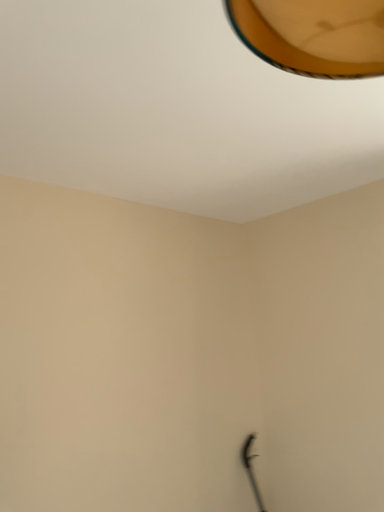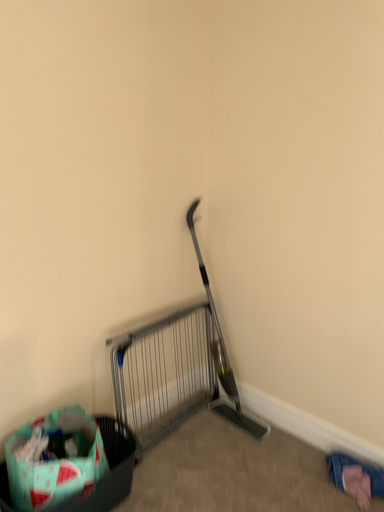
Question: Which way did the camera rotate in the video?

Choices:
 (A) rotated right
 (B) rotated left

Answer: (A)